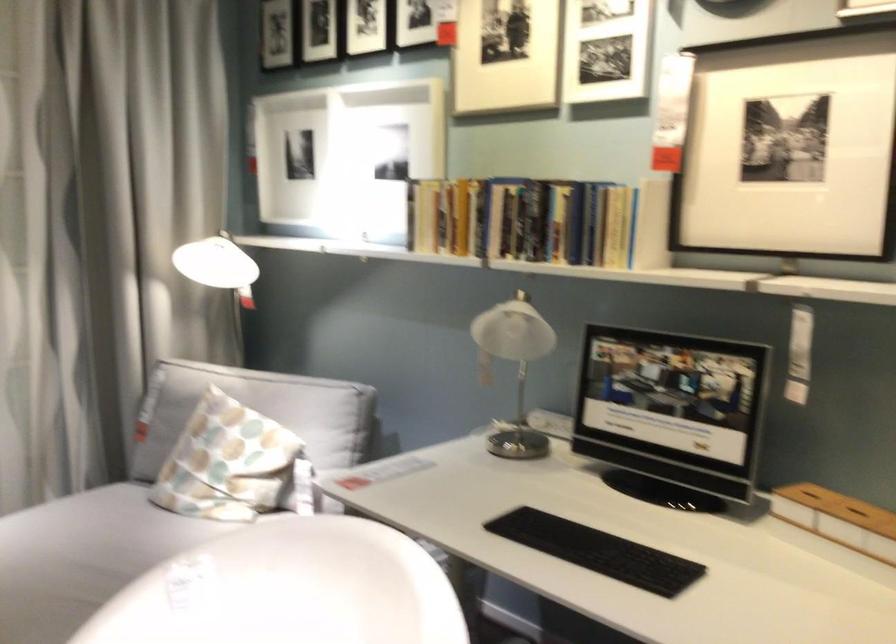
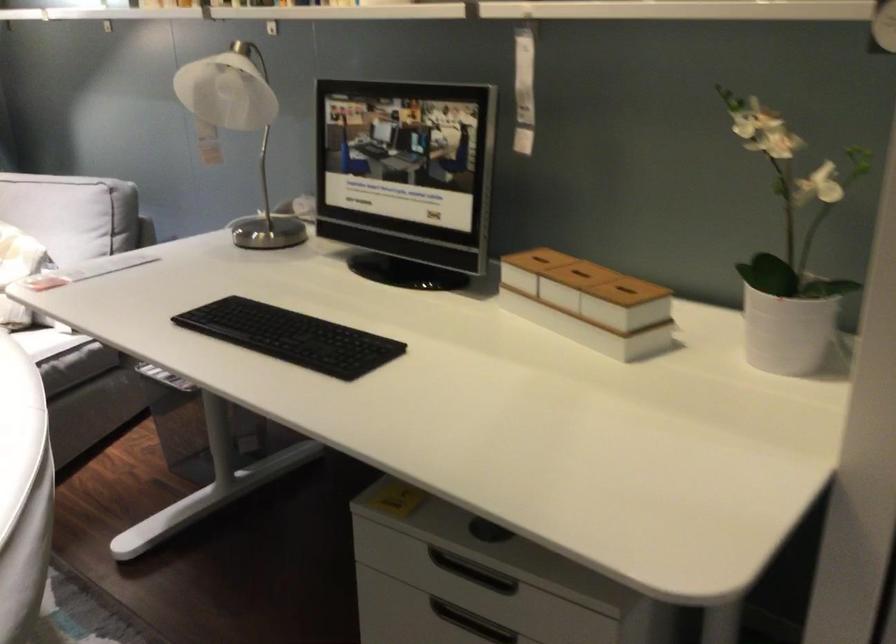
The point at (591, 554) is marked in the first image. Where is the corresponding point in the second image?

(291, 337)